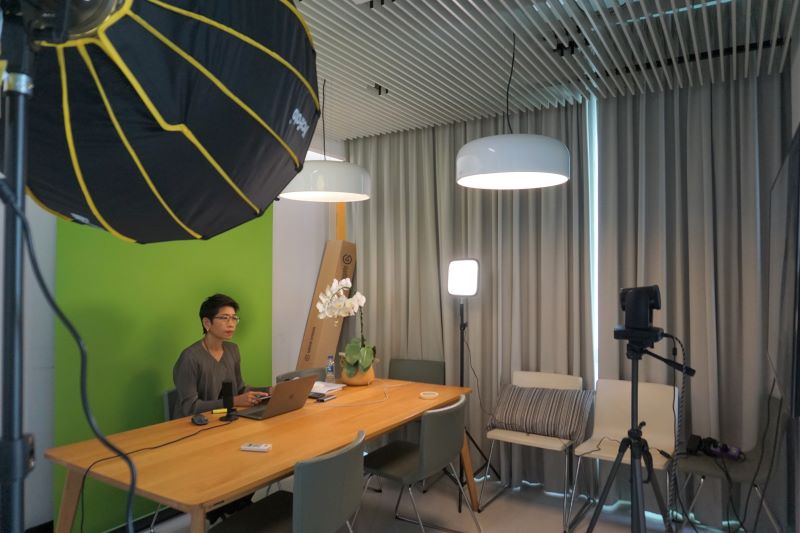
The width and height of the screenshot is (800, 533). In order to click on flooring in this screenshot , I will do (514, 506).